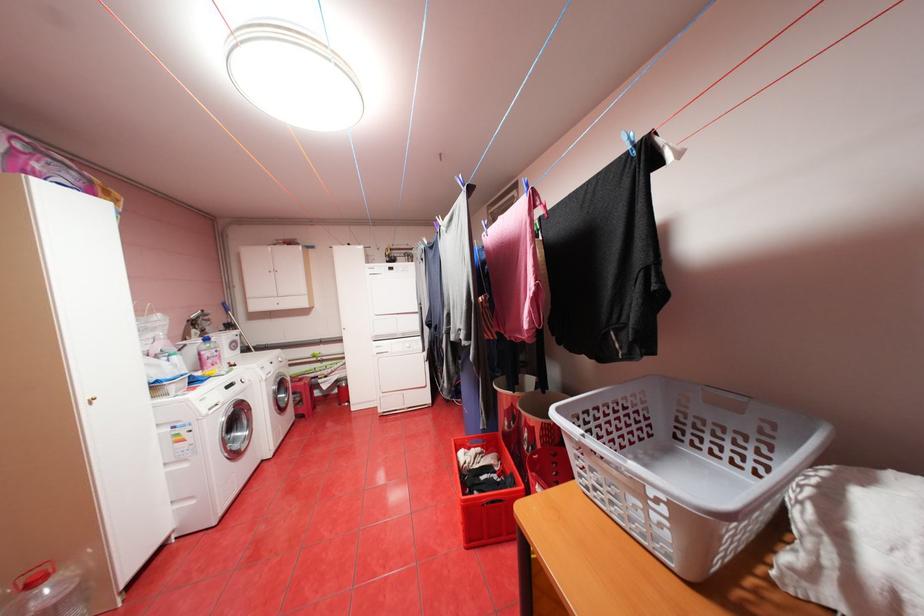
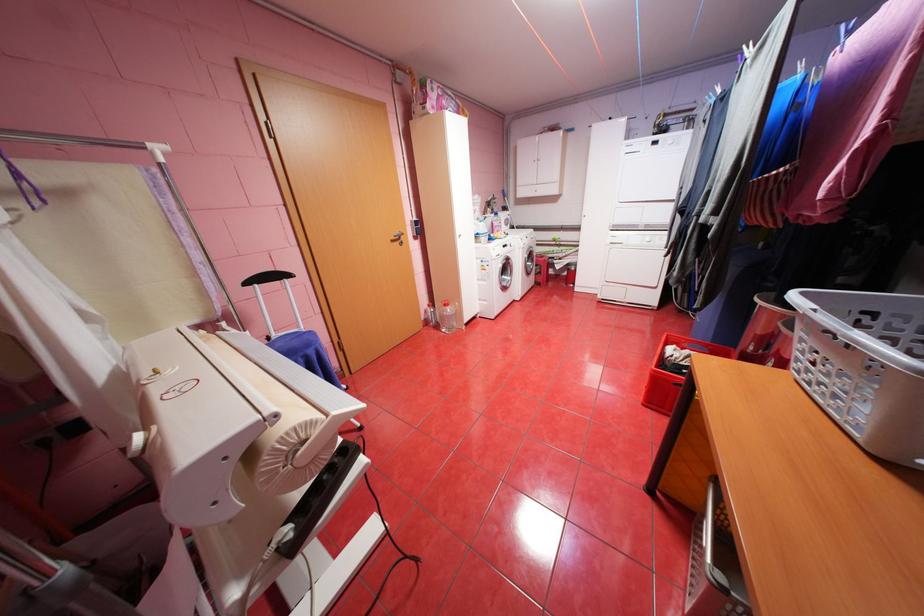
Where in the second image is the point corresponding to point 478,448 from the first image?

(691, 349)